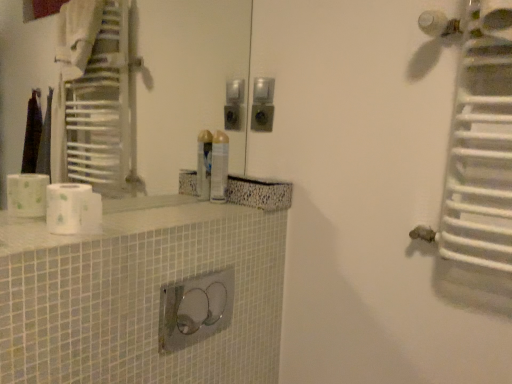
Question: Considering the relative positions of white matte toilet paper at left and metallic silver spray can at center in the image provided, is white matte toilet paper at left to the right of metallic silver spray can at center from the viewer's perspective?

Choices:
 (A) no
 (B) yes

Answer: (A)

Question: Is metallic silver spray can at center a part of white matte toilet paper at left?

Choices:
 (A) yes
 (B) no

Answer: (B)

Question: From the image's perspective, is white matte toilet paper at left on top of metallic silver spray can at center?

Choices:
 (A) no
 (B) yes

Answer: (A)

Question: Considering the relative positions of white matte toilet paper at left and metallic silver spray can at center in the image provided, is white matte toilet paper at left to the left of metallic silver spray can at center from the viewer's perspective?

Choices:
 (A) no
 (B) yes

Answer: (B)

Question: Is white matte toilet paper at left wider than metallic silver spray can at center?

Choices:
 (A) yes
 (B) no

Answer: (A)

Question: From the image's perspective, relative to white glossy counter top at center, is metallic silver spray can at center above or below?

Choices:
 (A) above
 (B) below

Answer: (A)

Question: Considering the positions of point (223, 178) and point (148, 225), is point (223, 178) closer or farther from the camera than point (148, 225)?

Choices:
 (A) farther
 (B) closer

Answer: (A)

Question: Is metallic silver spray can at center spatially inside white glossy counter top at center, or outside of it?

Choices:
 (A) outside
 (B) inside

Answer: (A)

Question: Considering the positions of metallic silver spray can at center and white glossy counter top at center in the image, is metallic silver spray can at center bigger or smaller than white glossy counter top at center?

Choices:
 (A) small
 (B) big

Answer: (A)

Question: Is metallic silver spray can at center wider or thinner than white metallic radiator at upper right?

Choices:
 (A) thin
 (B) wide

Answer: (A)

Question: From the image's perspective, is metallic silver spray can at center positioned above or below white metallic radiator at upper right?

Choices:
 (A) below
 (B) above

Answer: (A)

Question: Does point (225, 180) appear closer or farther from the camera than point (504, 188)?

Choices:
 (A) closer
 (B) farther

Answer: (B)

Question: In the image, is metallic silver spray can at center positioned in front of or behind white metallic radiator at upper right?

Choices:
 (A) front
 (B) behind

Answer: (B)

Question: In the image, is white matte toilet paper at left positioned in front of or behind metallic silver spray can at center?

Choices:
 (A) behind
 (B) front

Answer: (B)

Question: From their relative heights in the image, would you say white matte toilet paper at left is taller or shorter than metallic silver spray can at center?

Choices:
 (A) short
 (B) tall

Answer: (A)